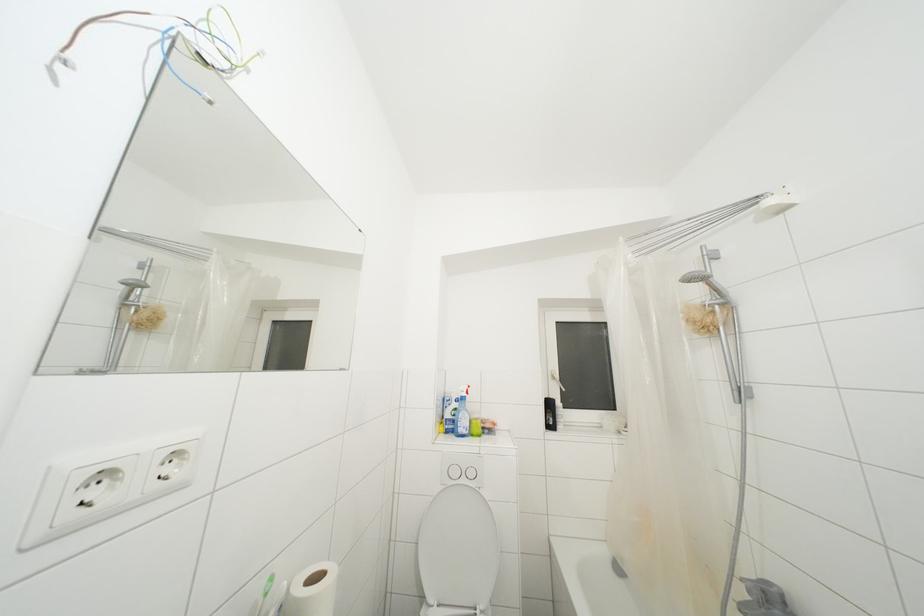
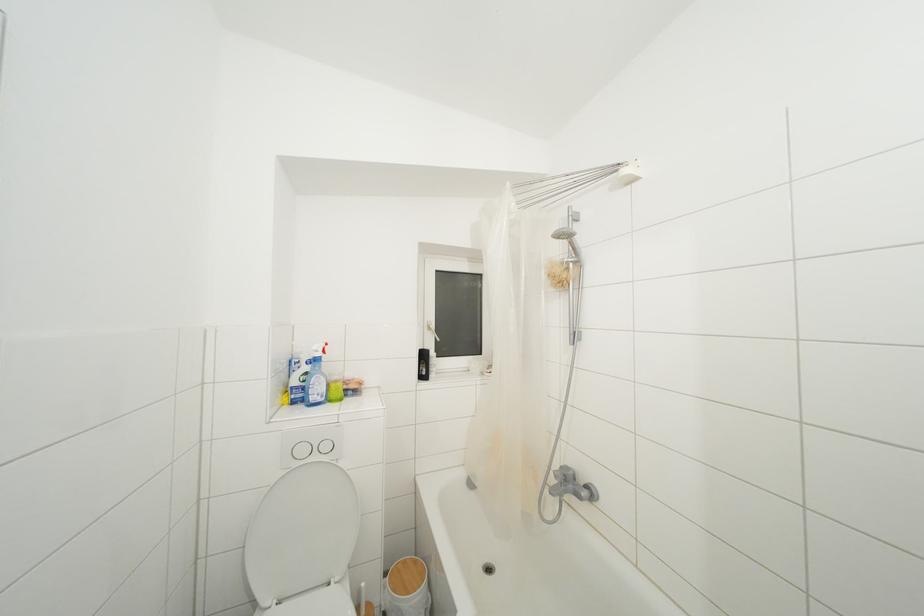
The point at (553, 410) is marked in the first image. Where is the corresponding point in the second image?

(428, 361)